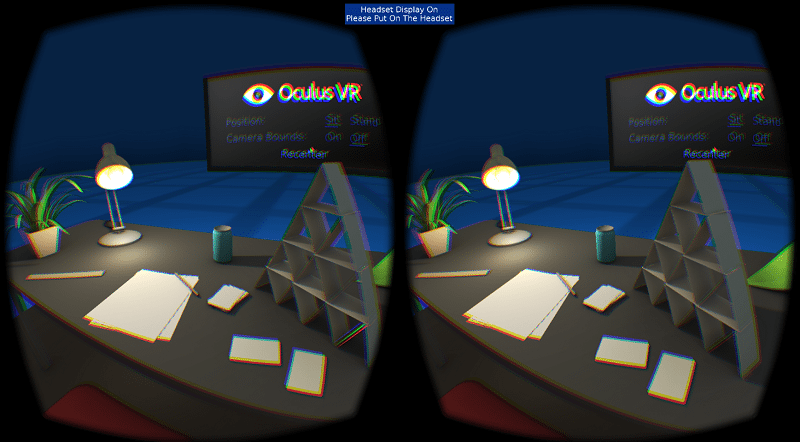
I want to click on lamp, so click(x=498, y=174).